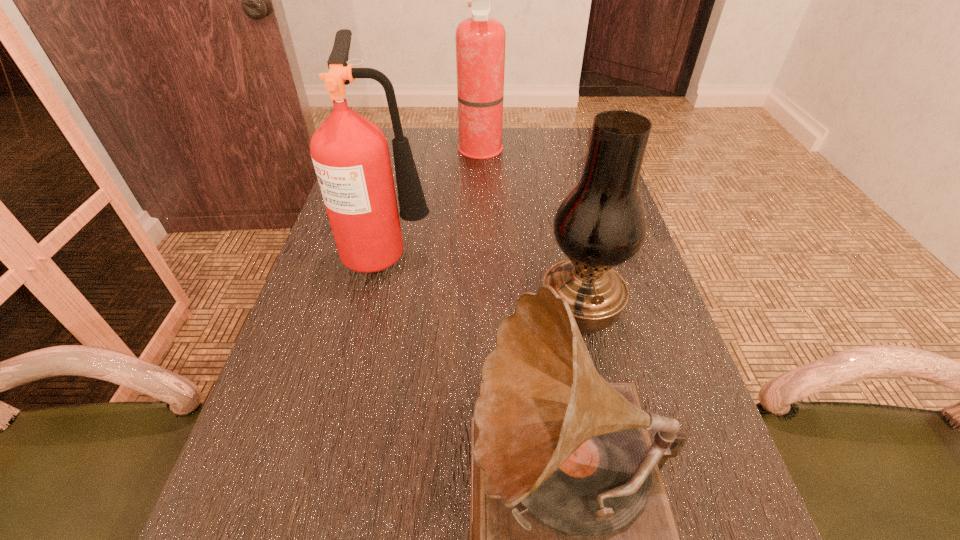
I want to click on free spot between the right fire extinguisher and the second nearest object, so click(x=530, y=231).

Locate which object ranks third in proximity to the oil lamp. Please provide its 2D coordinates. Your answer should be formatted as a tuple, i.e. [(x, y)], where the tuple contains the x and y coordinates of a point satisfying the conditions above.

[(480, 40)]

The width and height of the screenshot is (960, 540). What are the coordinates of `object that is the closest one to the farther fire extinguisher` in the screenshot? It's located at (350, 154).

This screenshot has width=960, height=540. Find the location of `free spot that satisfies the following two spatial constraints: 1. at the nozzle of the nearer fire extinguisher; 2. on the back side of the oil lamp`. free spot that satisfies the following two spatial constraints: 1. at the nozzle of the nearer fire extinguisher; 2. on the back side of the oil lamp is located at coordinates (376, 310).

Where is `vacant area that satisfies the following two spatial constraints: 1. on the back side of the third farthest object; 2. with the handle and hose on the right fire extinguisher`? The height and width of the screenshot is (540, 960). vacant area that satisfies the following two spatial constraints: 1. on the back side of the third farthest object; 2. with the handle and hose on the right fire extinguisher is located at coordinates (545, 151).

Locate an element on the screen. This screenshot has width=960, height=540. free spot that satisfies the following two spatial constraints: 1. with the handle and hose on the oil lamp; 2. on the right side of the farther fire extinguisher is located at coordinates (481, 310).

Identify the location of vacant point that satisfies the following two spatial constraints: 1. on the back side of the oil lamp; 2. at the nozzle of the second farthest object. pos(567,252).